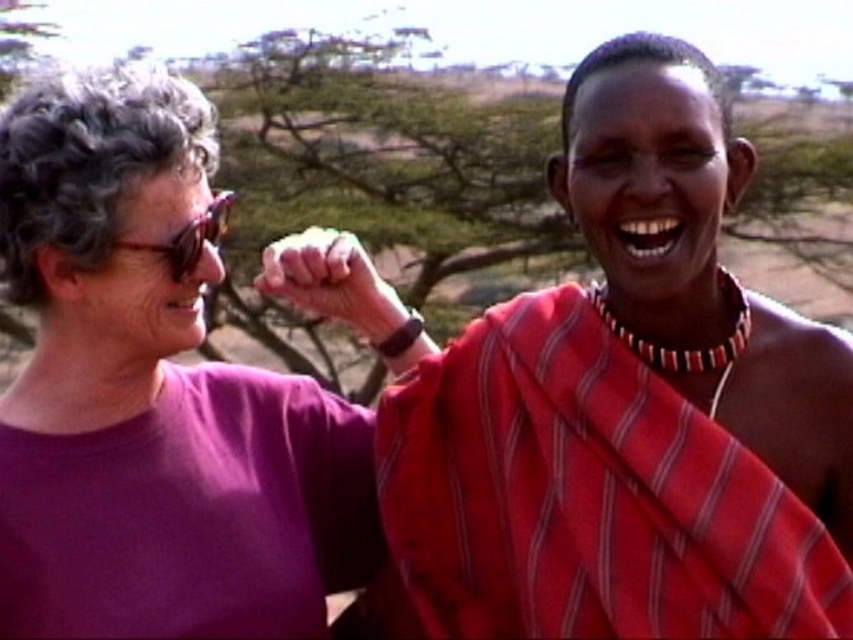
Question: Is red striped cloth at center to the left of purple matte shirt at left from the viewer's perspective?

Choices:
 (A) yes
 (B) no

Answer: (B)

Question: Can you confirm if red striped cloth at center is wider than purple matte shirt at left?

Choices:
 (A) no
 (B) yes

Answer: (B)

Question: Is red striped cloth at center above purple matte shirt at left?

Choices:
 (A) yes
 (B) no

Answer: (B)

Question: Which point is closer to the camera?

Choices:
 (A) (430, 428)
 (B) (378, 532)

Answer: (A)